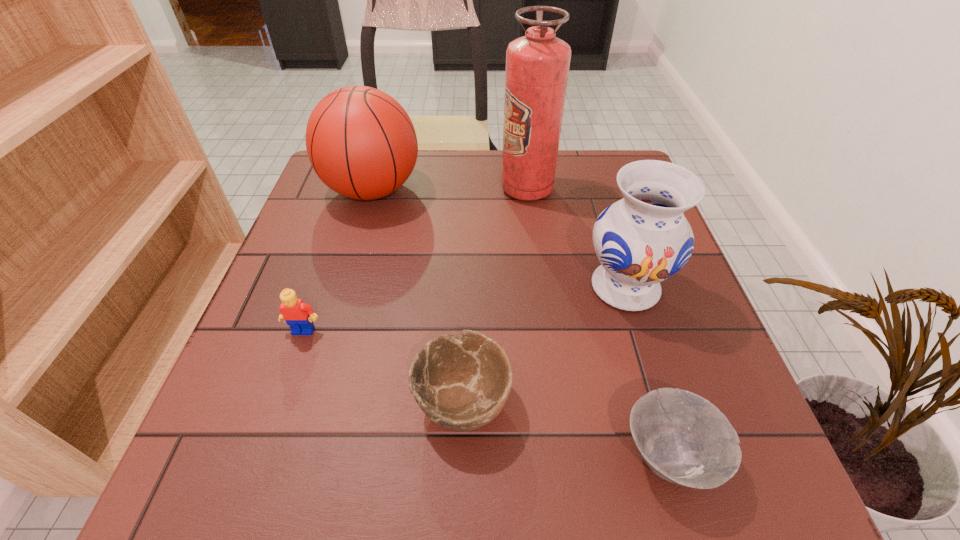
You are a GUI agent. You are given a task and a screenshot of the screen. Output one action in this format:
    pyautogui.click(x=<x>, y=<y>)
    Task: Click on the free space located on the label side of the fire extinguisher
    The height and width of the screenshot is (540, 960).
    Given the screenshot: What is the action you would take?
    pyautogui.click(x=474, y=189)

I want to click on vacant space located 0.400m on the label side of the fire extinguisher, so point(348,189).

I want to click on vacant area situated 0.390m on the label side of the fire extinguisher, so click(x=351, y=189).

Locate an element on the screen. This screenshot has height=540, width=960. vacant region located 0.080m on the front of the basketball is located at coordinates (357, 245).

Locate an element on the screen. blank space located on the left of the third farthest object is located at coordinates (456, 287).

In order to click on free space located 0.060m on the face of the third nearest object in this screenshot , I will do point(292,363).

Find the location of a particular element. The width and height of the screenshot is (960, 540). free space located 0.110m on the right of the left bowl is located at coordinates (577, 400).

At what (x,y) coordinates should I click in order to perform the action: click on free space located on the left of the shorter bowl. Please return your answer as a coordinate pair (x, y). This screenshot has width=960, height=540. Looking at the image, I should click on (429, 455).

The height and width of the screenshot is (540, 960). Find the location of `fire extinguisher that is positioned at the far edge`. fire extinguisher that is positioned at the far edge is located at coordinates (537, 65).

Where is `basketball that is positioned at the far edge`? The width and height of the screenshot is (960, 540). basketball that is positioned at the far edge is located at coordinates (360, 141).